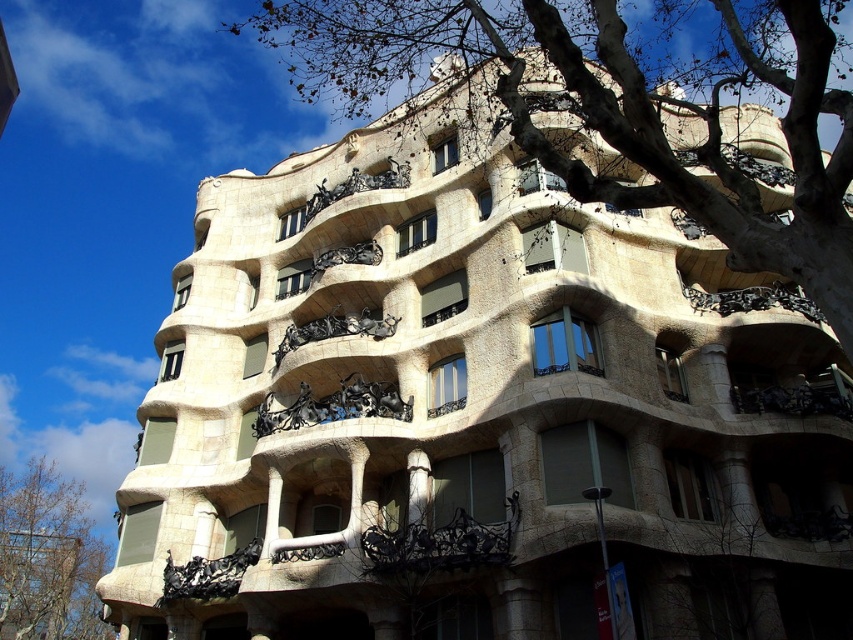
Question: Among these objects, which one is nearest to the camera?

Choices:
 (A) bare branches at upper center
 (B) brown leafy tree at lower left

Answer: (A)

Question: Is bare branches at upper center to the left of brown leafy tree at lower left from the viewer's perspective?

Choices:
 (A) yes
 (B) no

Answer: (B)

Question: Does bare branches at upper center have a larger size compared to brown leafy tree at lower left?

Choices:
 (A) no
 (B) yes

Answer: (B)

Question: Can you confirm if bare branches at upper center is thinner than brown leafy tree at lower left?

Choices:
 (A) yes
 (B) no

Answer: (B)